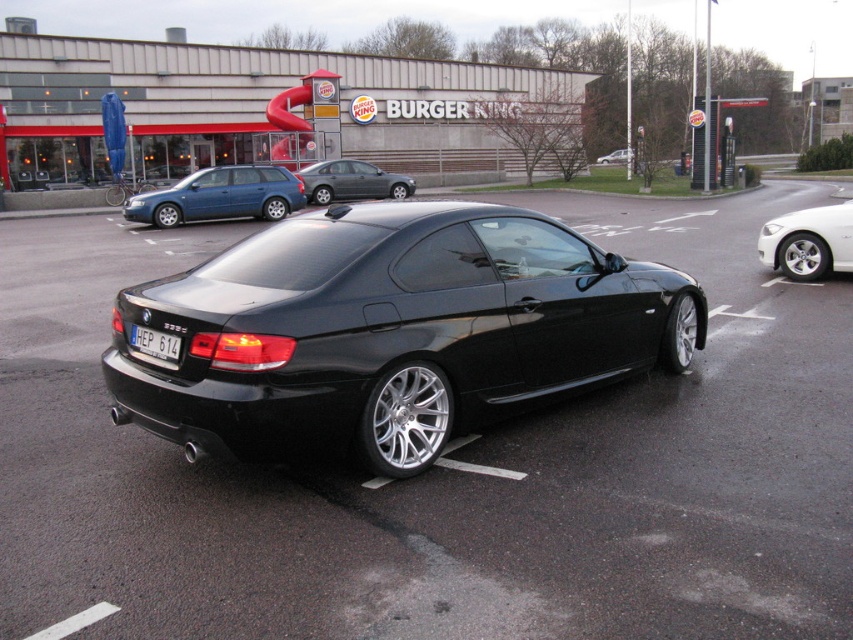
You are a parking attendant and need to guide a customer to their car. They mention they have a black metallic sports car at center parked near a matte blue station wagon at left. Based on the scene, which car is positioned to the right of the other?

The black metallic sports car at center is to the right of the matte blue station wagon at left.

Looking at this image, you are a delivery driver needing to exit the parking lot. You see the matte blue station wagon at left and the white metallic sedan at right. Which vehicle is blocking your path if you want to leave?

The white metallic sedan at right is behind matte blue station wagon at left, so the matte blue station wagon at left is blocking the path.